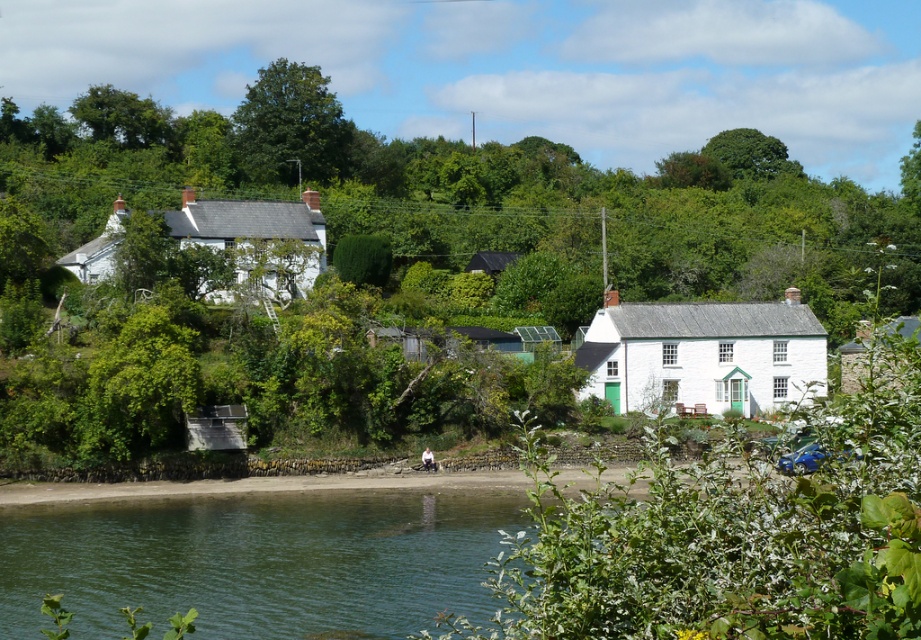
You are standing 300 feet away from the green leafy tree at center. Can you reach the tree within 10 seconds if you walk at a speed of 3.5 feet per second?

The distance between you and the green leafy tree at center is 322.31 feet. At a walking speed of 3.5 feet per second, it would take approximately 92 seconds to reach the tree. Therefore, you cannot reach the tree within 10 seconds.

You are standing in the middle of the rural scene and want to walk towards the two points marked in the image. Which point, point (246,93) or point (791,292), will you reach first?

You will reach point (246,93) first because it is closer to you than point (791,292).